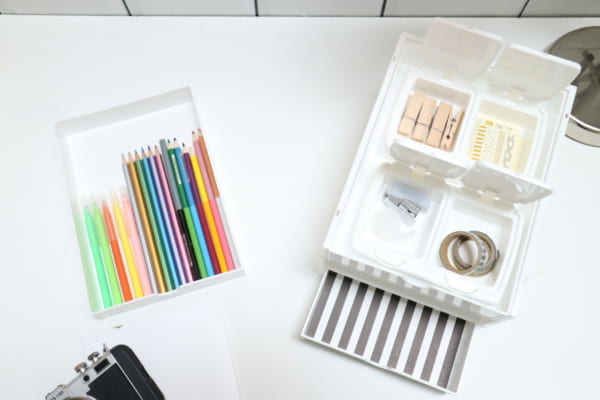
You are a GUI agent. You are given a task and a screenshot of the screen. Output one action in this format:
    pyautogui.click(x=<x>, y=<y>)
    Task: Click on the double-ended colored pencils
    This screenshot has width=600, height=400.
    Given the screenshot: What is the action you would take?
    pyautogui.click(x=209, y=169), pyautogui.click(x=207, y=178), pyautogui.click(x=200, y=185), pyautogui.click(x=196, y=199), pyautogui.click(x=196, y=215), pyautogui.click(x=187, y=207), pyautogui.click(x=180, y=217)